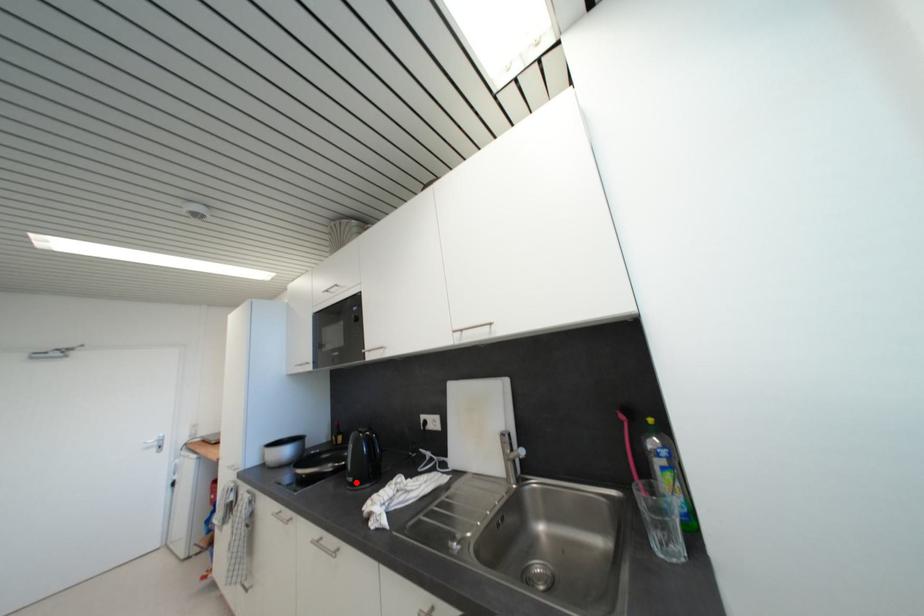
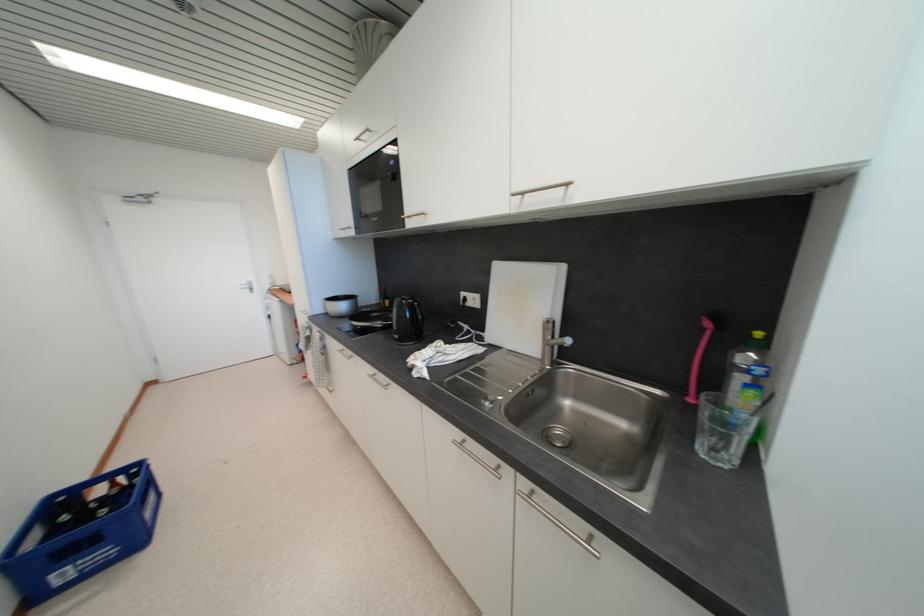
Question: I am providing you with two images of the same scene from different viewpoints. A red point is shown in image1. For the corresponding object point in image2, is it positioned nearer or farther from the camera?

Choices:
 (A) Nearer
 (B) Farther

Answer: (A)